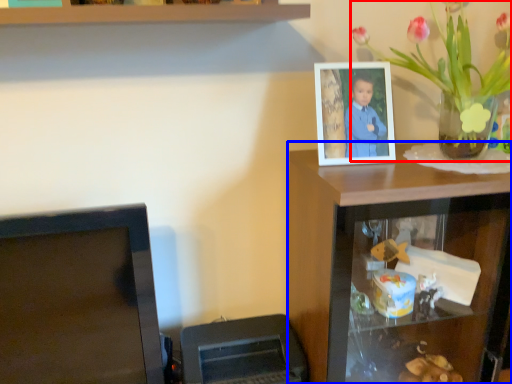
Question: Which object is further to the camera taking this photo, houseplant (highlighted by a red box) or computer desk (highlighted by a blue box)?

Choices:
 (A) houseplant
 (B) computer desk

Answer: (B)